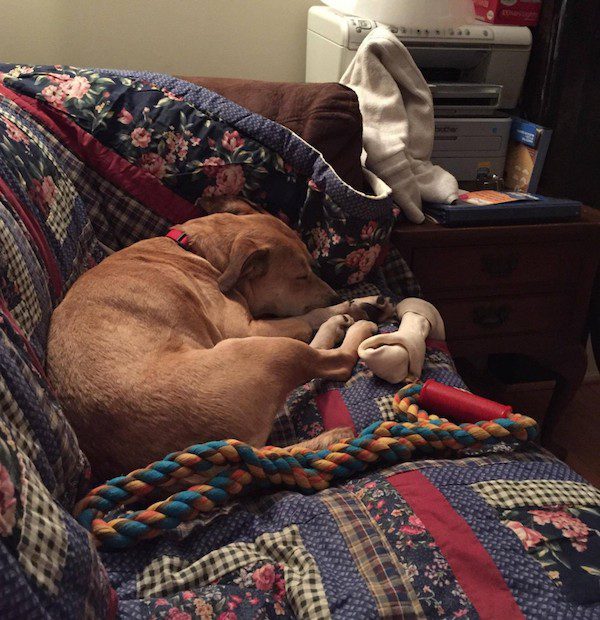
Where is `printer`? Image resolution: width=600 pixels, height=620 pixels. printer is located at coordinates (507, 67).